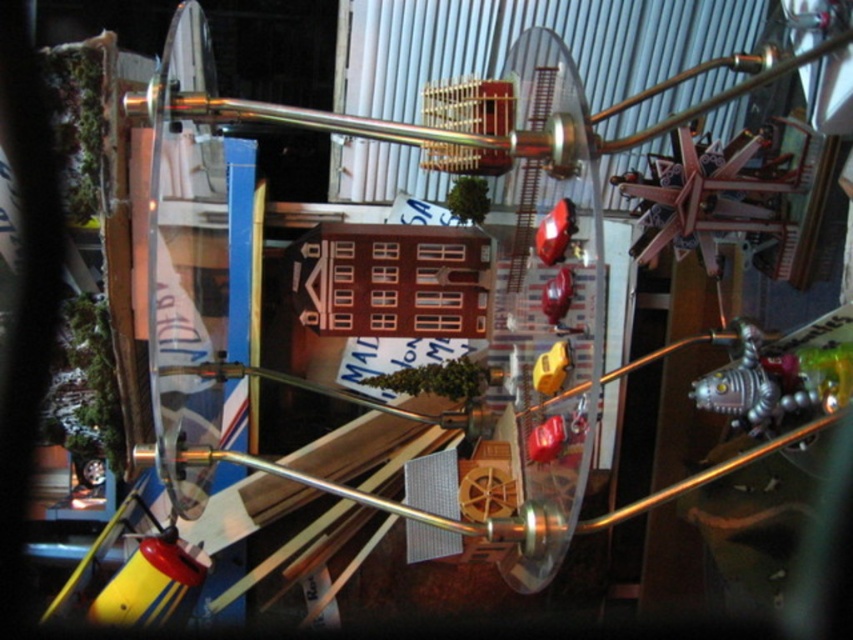
You are a child playing with the miniature scene. You want to place a sticker on the object that is wider between the glossy plastic apple at center and the glossy red car at center. Which object should you choose?

The glossy plastic apple at center is wider than the glossy red car at center, so you should place the sticker on the glossy plastic apple at center.

What is located at the coordinates point [555,232]?

The glossy plastic car at center is located at point [555,232].